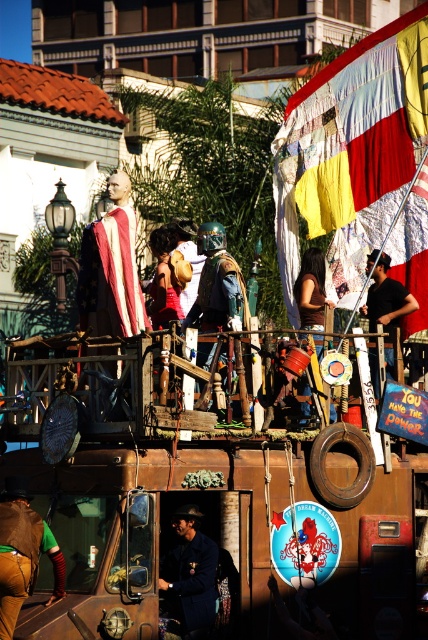
Question: Can you confirm if quilted fabric flag at upper right is smaller than matte black shirt at center?

Choices:
 (A) no
 (B) yes

Answer: (A)

Question: Among these points, which one is nearest to the camera?

Choices:
 (A) (210, 564)
 (B) (351, 54)
 (C) (166, 416)

Answer: (C)

Question: Among these objects, which one is nearest to the camera?

Choices:
 (A) red fabric at center
 (B) brown fabric at center

Answer: (B)

Question: Which of the following is the closest to the observer?

Choices:
 (A) matte black shirt at center
 (B) quilted fabric flag at upper right
 (C) brown leather vest at lower left

Answer: (C)

Question: Is dark blue fabric at center wider than brown fabric at center?

Choices:
 (A) no
 (B) yes

Answer: (A)

Question: Can you confirm if dark blue fabric at center is wider than matte black shirt at center?

Choices:
 (A) yes
 (B) no

Answer: (B)